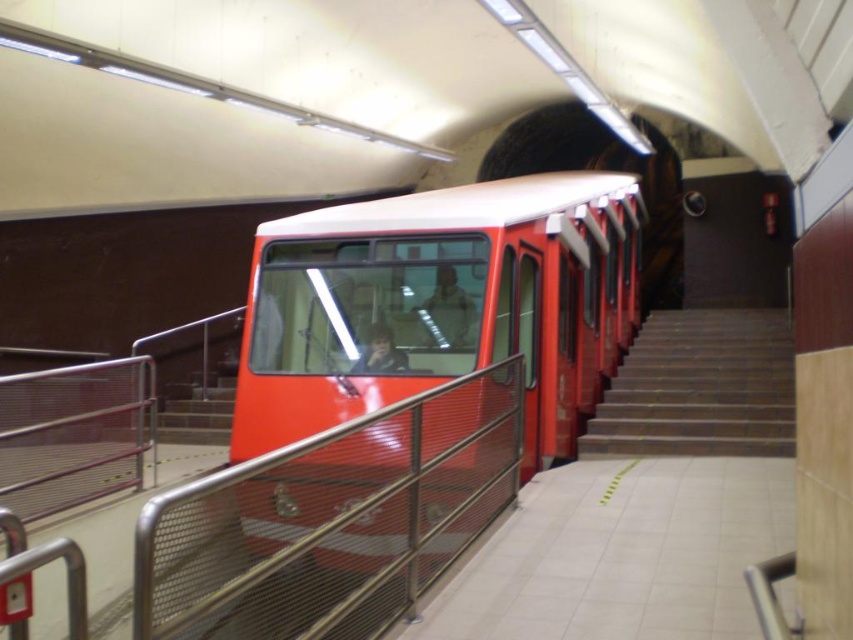
You are standing on the subway platform and want to reach both the point marked as point [546,420] and the point marked as point [177,634]. Which point is closer to you?

Point [546,420] is closer to you because it is further to the viewer than point [177,634].

You are a maintenance worker needing to reach the smooth concrete stairs at right from your current position near the metal mesh railing at center. If your tool cart is 1.5 meters wide, can you maneuver it through the space between them?

The metal mesh railing at center is 4.26 meters away from the smooth concrete stairs at right. Since the tool cart is only 1.5 meters wide, there is sufficient space to maneuver it between them.

Based on the photo, you are a passenger waiting on the subway platform. You notice the matte red train at center and the metal mesh railing at center. Which object is closer to you if you are standing on the platform floor?

The matte red train at center is positioned over the metal mesh railing at center, meaning it is closer to you since it is above the railing.